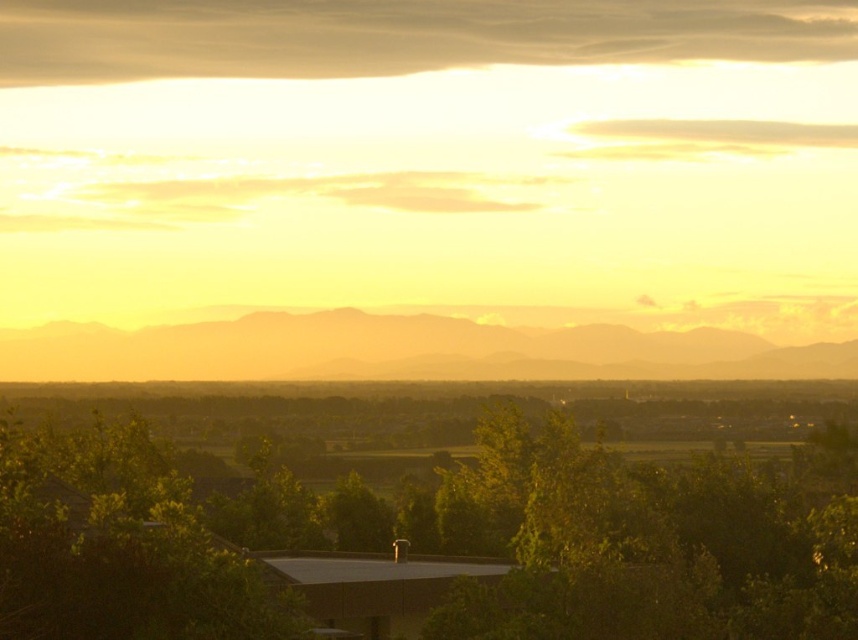
Question: Does green leafy tree at center have a smaller size compared to dull orange mountain at center?

Choices:
 (A) no
 (B) yes

Answer: (A)

Question: Which object is farther from the camera taking this photo?

Choices:
 (A) green leafy tree at center
 (B) dull orange mountain at center

Answer: (B)

Question: Which point is closer to the camera?

Choices:
 (A) green leafy tree at center
 (B) dull orange mountain at center

Answer: (A)

Question: Does green leafy tree at center appear under dull orange mountain at center?

Choices:
 (A) no
 (B) yes

Answer: (B)

Question: Is green leafy tree at center smaller than dull orange mountain at center?

Choices:
 (A) no
 (B) yes

Answer: (A)

Question: Among these objects, which one is nearest to the camera?

Choices:
 (A) dull orange mountain at center
 (B) green leafy tree at center

Answer: (B)